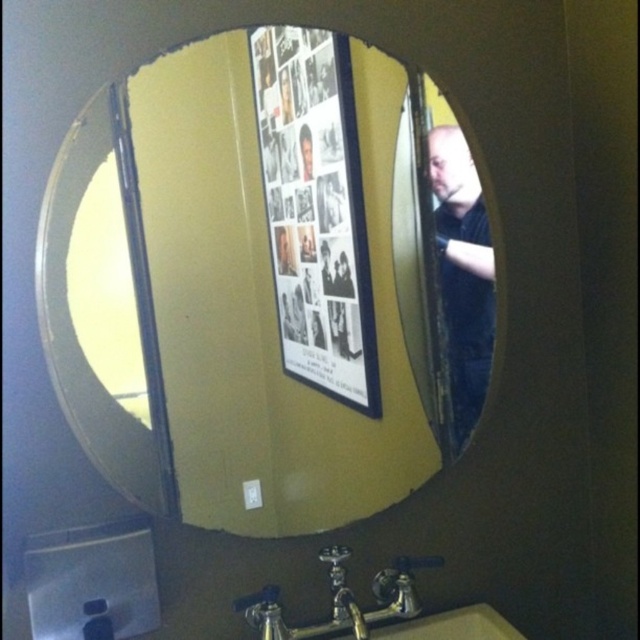
Consider the image. You are standing in the bathroom and looking at the mirror. You notice two points reflected in the mirror. The first point is at coordinates point(228, 305) and the second point is at point(316, 209). Which of these two points in the mirror is closer to you?

Point(228, 305) is closer to you than point(316, 209) because it has a smaller y coordinate in the mirror reflection, indicating it is nearer to the viewer.

You are standing in a bathroom and see the matte glass mirror at center and the dark blue shirt at right. Which object is located to the left of the other?

The matte glass mirror at center is positioned on the left side of dark blue shirt at right.